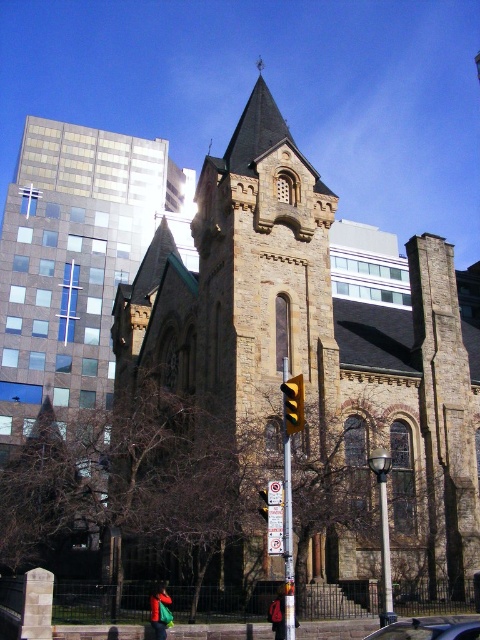
You are a delivery person who needs to park your 2.5 meters tall delivery van. You see the metallic silver car at center and the yellow matte traffic light at center in the image. Which object is taller than your van, making it impossible to park there?

The metallic silver car at center is much taller than the yellow matte traffic light at center. Since the van is 2.5 meters tall, the metallic silver car at center is taller than the van, so parking there would not be possible due to its height.

You are standing at the intersection of two streets, looking at the brown stone church at center. If you want to take a photo that includes both the church and the modern highrise building to the left, which direction should you face to ensure both are in the frame?

Since the brown stone church at center is located at point (319,346), you should face towards the left to include both the church and the modern highrise building in your photo.

You are a pedestrian standing at the intersection and see the metallic silver car at center and the yellow matte traffic light at center. Which object is closer to your right side?

The metallic silver car at center is to the right of the yellow matte traffic light at center, so the metallic silver car at center is closer to your right side.